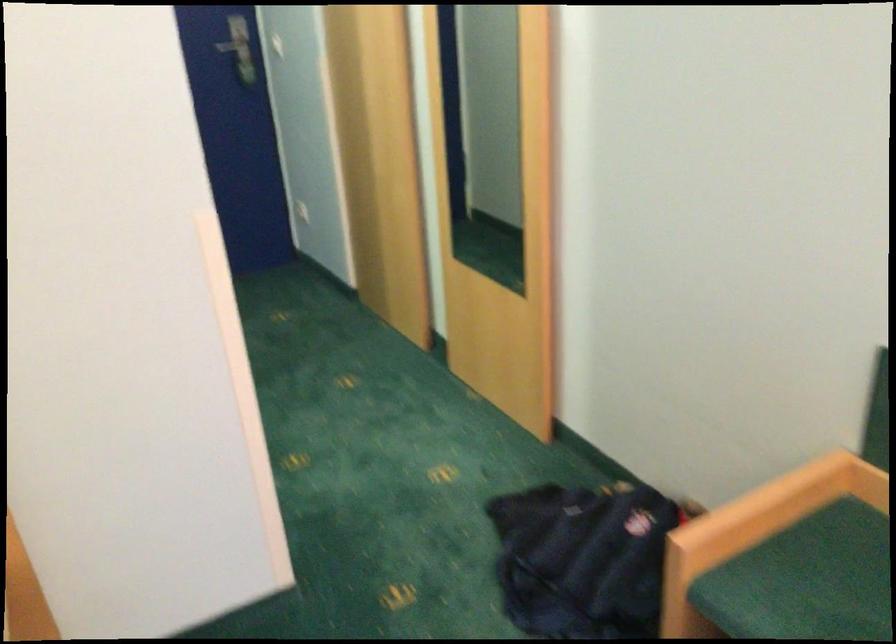
What do you see at coordinates (234, 46) in the screenshot?
I see `a metal door handle` at bounding box center [234, 46].